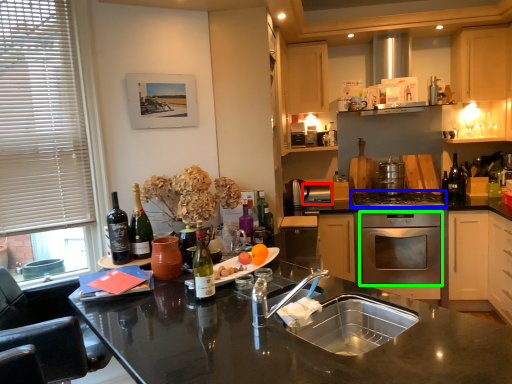
Question: Based on their relative distances, which object is farther from appliance (highlighted by a red box)? Choose from gas stove (highlighted by a blue box) and oven (highlighted by a green box).

Choices:
 (A) gas stove
 (B) oven

Answer: (B)